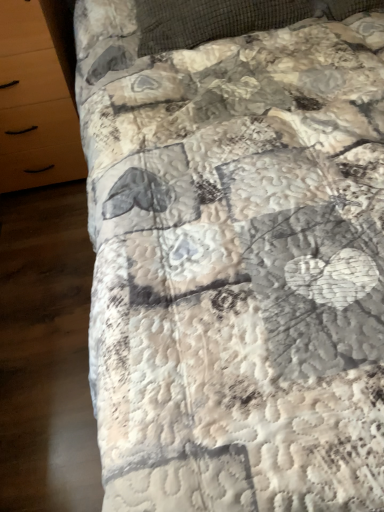
Locate an element on the screen. This screenshot has width=384, height=512. matte wood chest of drawers at left is located at coordinates (37, 96).

Describe the element at coordinates (37, 96) in the screenshot. I see `matte wood chest of drawers at left` at that location.

Image resolution: width=384 pixels, height=512 pixels. I want to click on matte wood chest of drawers at left, so click(37, 96).